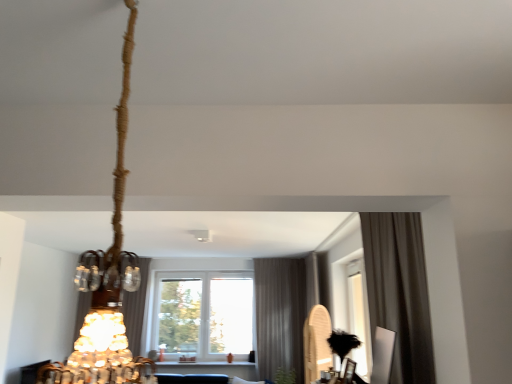
This screenshot has width=512, height=384. Identify the location of gray textured curtain at center, the 2th curtain when ordered from left to right. (280, 315).

Describe the element at coordinates (280, 315) in the screenshot. The image size is (512, 384). I see `gray textured curtain at center, the 2th curtain from the back` at that location.

What do you see at coordinates (106, 280) in the screenshot? I see `braided rope chandelier at upper left` at bounding box center [106, 280].

What is the approximate height of transparent glass window at center?

1.42 meters.

What do you see at coordinates (399, 291) in the screenshot?
I see `brown fabric curtain at right, positioned as the third curtain in back-to-front order` at bounding box center [399, 291].

This screenshot has width=512, height=384. What do you see at coordinates (316, 343) in the screenshot?
I see `wooden paddle at right` at bounding box center [316, 343].

The width and height of the screenshot is (512, 384). Identify the location of wooden paddle at right. (316, 343).

The height and width of the screenshot is (384, 512). Identify the location of gray textured curtain at center, positioned as the second curtain in right-to-left order. pos(280,315).

From the image's perspective, is gray textured curtain at center, which ranks as the 2th curtain in front-to-back order, located beneath braided rope chandelier at upper left?

Yes, from the image's perspective, gray textured curtain at center, which ranks as the 2th curtain in front-to-back order, is beneath braided rope chandelier at upper left.

Considering the relative sizes of gray textured curtain at center, positioned as the second curtain in right-to-left order, and braided rope chandelier at upper left in the image provided, is gray textured curtain at center, positioned as the second curtain in right-to-left order, taller than braided rope chandelier at upper left?

Indeed, gray textured curtain at center, positioned as the second curtain in right-to-left order, has a greater height compared to braided rope chandelier at upper left.

Consider the image. Is gray textured curtain at center, which ranks as the 2th curtain in front-to-back order, positioned far away from braided rope chandelier at upper left?

Indeed, gray textured curtain at center, which ranks as the 2th curtain in front-to-back order, is not near braided rope chandelier at upper left.

Is gray textured curtain at center, the 2th curtain when ordered from left to right, aimed at braided rope chandelier at upper left?

Yes.

Which is nearer, (118, 231) or (233, 286)?

Point (118, 231) is closer to the camera than point (233, 286).

Between braided rope chandelier at upper left and transparent glass window at center, which one has larger width?

braided rope chandelier at upper left.

From a real-world perspective, between braided rope chandelier at upper left and transparent glass window at center, who is vertically lower?

From a 3D spatial view, transparent glass window at center is below.

Where is `lamp in front of the satin brown curtain at center, acting as the first curtain starting from the back`? lamp in front of the satin brown curtain at center, acting as the first curtain starting from the back is located at coordinates pos(106,280).

From a real-world perspective, is braided rope chandelier at upper left physically located above or below satin brown curtain at center, placed as the first curtain when sorted from left to right?

In terms of real-world spatial position, braided rope chandelier at upper left is above satin brown curtain at center, placed as the first curtain when sorted from left to right.

How many degrees apart are the facing directions of braided rope chandelier at upper left and satin brown curtain at center, placed as the first curtain when sorted from left to right?

170 degrees.

Is braided rope chandelier at upper left to the left of satin brown curtain at center, which is counted as the 3th curtain, starting from the front, from the viewer's perspective?

In fact, braided rope chandelier at upper left is to the right of satin brown curtain at center, which is counted as the 3th curtain, starting from the front.

From the image's perspective, between transparent glass window at center and green leafy plant at lower center, who is located below?

transparent glass window at center appears lower in the image.

Which is behind, point (251, 315) or point (293, 377)?

The point (251, 315) is farther.

Can you confirm if transparent glass window at center is wider than green leafy plant at lower center?

Incorrect, the width of transparent glass window at center does not surpass that of green leafy plant at lower center.

Is transparent glass window at center not near green leafy plant at lower center?

transparent glass window at center is far away from green leafy plant at lower center.

How distant is satin brown curtain at center, which is counted as the 3th curtain, starting from the front, from transparent glass window at center?

They are 76.77 centimeters apart.

Is satin brown curtain at center, which is the third curtain from right to left, to the left or to the right of transparent glass window at center in the image?

From the image, it's evident that satin brown curtain at center, which is the third curtain from right to left, is to the left of transparent glass window at center.

Are satin brown curtain at center, which is counted as the 3th curtain, starting from the front, and transparent glass window at center making contact?

No, satin brown curtain at center, which is counted as the 3th curtain, starting from the front, is not next to transparent glass window at center.

Is satin brown curtain at center, which is counted as the 3th curtain, starting from the front, oriented away from transparent glass window at center?

No, satin brown curtain at center, which is counted as the 3th curtain, starting from the front,'s orientation is not away from transparent glass window at center.

Between wooden paddle at right and satin brown curtain at center, which is the third curtain from right to left, which one has smaller width?

Thinner between the two is satin brown curtain at center, which is the third curtain from right to left.

From the image's perspective, which one is positioned lower, wooden paddle at right or satin brown curtain at center, placed as the first curtain when sorted from left to right?

satin brown curtain at center, placed as the first curtain when sorted from left to right, is shown below in the image.

In the image, is wooden paddle at right positioned in front of or behind satin brown curtain at center, placed as the first curtain when sorted from left to right?

Visually, wooden paddle at right is located in front of satin brown curtain at center, placed as the first curtain when sorted from left to right.

Looking at the image, does wooden paddle at right seem bigger or smaller compared to satin brown curtain at center, placed as the first curtain when sorted from left to right?

Considering their sizes, wooden paddle at right takes up less space than satin brown curtain at center, placed as the first curtain when sorted from left to right.

Is satin brown curtain at center, which is the third curtain from right to left, located outside green leafy plant at lower center?

satin brown curtain at center, which is the third curtain from right to left, is positioned outside green leafy plant at lower center.

Is satin brown curtain at center, which is counted as the 3th curtain, starting from the front, aimed at green leafy plant at lower center?

No, satin brown curtain at center, which is counted as the 3th curtain, starting from the front, is not turned towards green leafy plant at lower center.

In terms of height, does satin brown curtain at center, which is the third curtain from right to left, look taller or shorter compared to green leafy plant at lower center?

Considering their sizes, satin brown curtain at center, which is the third curtain from right to left, has more height than green leafy plant at lower center.

Identify the location of lamp that appears above the gray textured curtain at center, positioned as the second curtain in right-to-left order (from a real-world perspective). (106, 280).

Locate an element on the screen. Image resolution: width=512 pixels, height=384 pixels. window below the braided rope chandelier at upper left (from the image's perspective) is located at coordinates [201, 314].

Estimate the real-world distances between objects in this image. Which object is closer to wooden paddle at right, satin brown curtain at center, which is the third curtain from right to left, or gray textured curtain at center, the 2th curtain from the back?

gray textured curtain at center, the 2th curtain from the back, is positioned closer to the anchor wooden paddle at right.

Which object lies further to the anchor point green leafy plant at lower center, transparent glass window at center or wooden paddle at right?

Based on the image, wooden paddle at right appears to be further to green leafy plant at lower center.

Based on their spatial positions, is gray textured curtain at center, which ranks as the 2th curtain in front-to-back order, or green leafy plant at lower center closer to brown fabric curtain at right, which is counted as the 1th curtain, starting from the front?

Among the two, gray textured curtain at center, which ranks as the 2th curtain in front-to-back order, is located nearer to brown fabric curtain at right, which is counted as the 1th curtain, starting from the front.

Based on their spatial positions, is brown fabric curtain at right, which appears as the 3th curtain when viewed from the left, or transparent glass window at center closer to braided rope chandelier at upper left?

brown fabric curtain at right, which appears as the 3th curtain when viewed from the left, is closer to braided rope chandelier at upper left.

Based on their spatial positions, is green leafy plant at lower center or satin brown curtain at center, which is the third curtain from right to left, closer to wooden paddle at right?

green leafy plant at lower center is closer to wooden paddle at right.

From the image, which object appears to be farther from brown fabric curtain at right, positioned as the third curtain in back-to-front order, green leafy plant at lower center or braided rope chandelier at upper left?

Based on the image, green leafy plant at lower center appears to be further to brown fabric curtain at right, positioned as the third curtain in back-to-front order.

From the image, which object appears to be farther from brown fabric curtain at right, placed as the first curtain when sorted from right to left, green leafy plant at lower center or wooden paddle at right?

green leafy plant at lower center lies further to brown fabric curtain at right, placed as the first curtain when sorted from right to left, than the other object.

Estimate the real-world distances between objects in this image. Which object is closer to green leafy plant at lower center, wooden paddle at right or gray textured curtain at center, the 2th curtain from the back?

gray textured curtain at center, the 2th curtain from the back.

Identify the location of wood positioned between brown fabric curtain at right, positioned as the third curtain in back-to-front order, and transparent glass window at center from near to far. (316, 343).

This screenshot has width=512, height=384. I want to click on plant located between satin brown curtain at center, acting as the first curtain starting from the back, and wooden paddle at right in the left-right direction, so click(x=285, y=376).

Identify the location of wood located between braided rope chandelier at upper left and green leafy plant at lower center in the depth direction. (316, 343).

Identify the location of wood between braided rope chandelier at upper left and transparent glass window at center from front to back. The width and height of the screenshot is (512, 384). (316, 343).